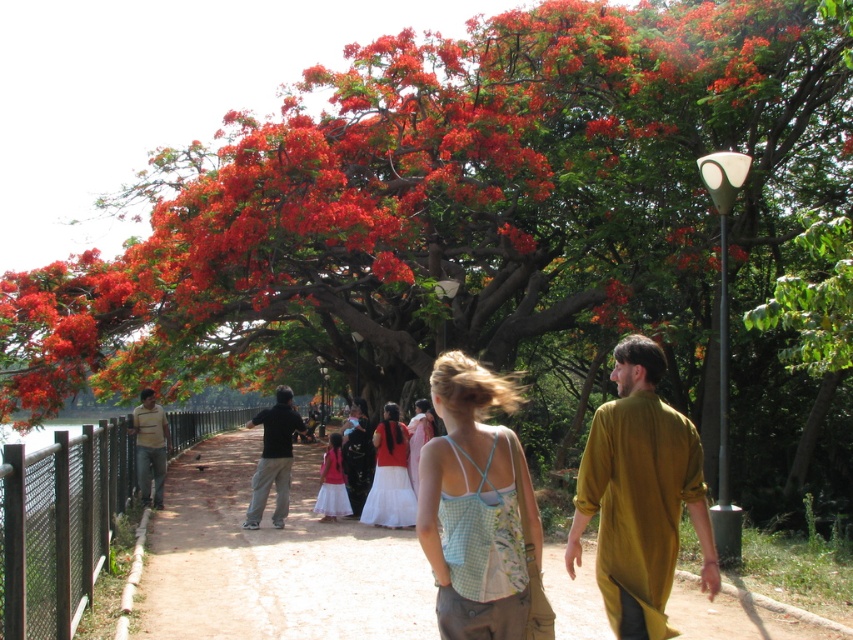
You are a fashion designer observing people walking on a pathway surrounded by greenery and red flowers. You notice two shirts, a black cotton shirt at center and a light brown cotton shirt at left. Which shirt has a bigger size?

The black cotton shirt at center has a larger size compared to the light brown cotton shirt at left.

You are a photographer trying to capture a candid shot of the black cotton shirt at center and the white cotton skirt at center. Since you want both to be in focus, which one should you focus on first to ensure the other is also sharp?

The black cotton shirt at center is much taller than the white cotton skirt at center, so focusing on the black cotton shirt at center first will ensure the white cotton skirt at center is also in focus because it is closer to the camera.